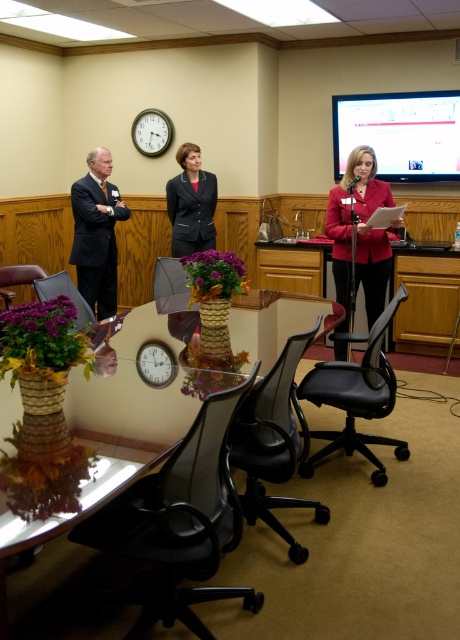
You are a guest entering the meeting room and need to sit down. You see the black plastic swivel chair at lower center and the dark blue suit at left. Which object is closer to the floor?

The black plastic swivel chair at lower center is below dark blue suit at left, so it is closer to the floor.

You are a person who is 1.8 meters tall and standing at the black plastic swivel chair at lower center. You want to reach the dark blue suit at left to pick up a pen that fell there. Can you comfortably reach it without moving from your current position?

The distance between the black plastic swivel chair at lower center and the dark blue suit at left is 3.18 meters. Since the person is only 1.8 meters tall, they cannot comfortably reach the dark blue suit at left from that distance without moving.

You are sitting at the conference table and want to hand a document to someone sitting near the matte red blazer at center. To do this, you need to pass the document over the matte plastic screen at upper right. Is this possible given their positions?

The matte plastic screen at upper right is further to the viewer than the matte red blazer at center, so you cannot pass the document over the matte plastic screen at upper right to reach the matte red blazer at center because the screen is closer to you and blocking the path.